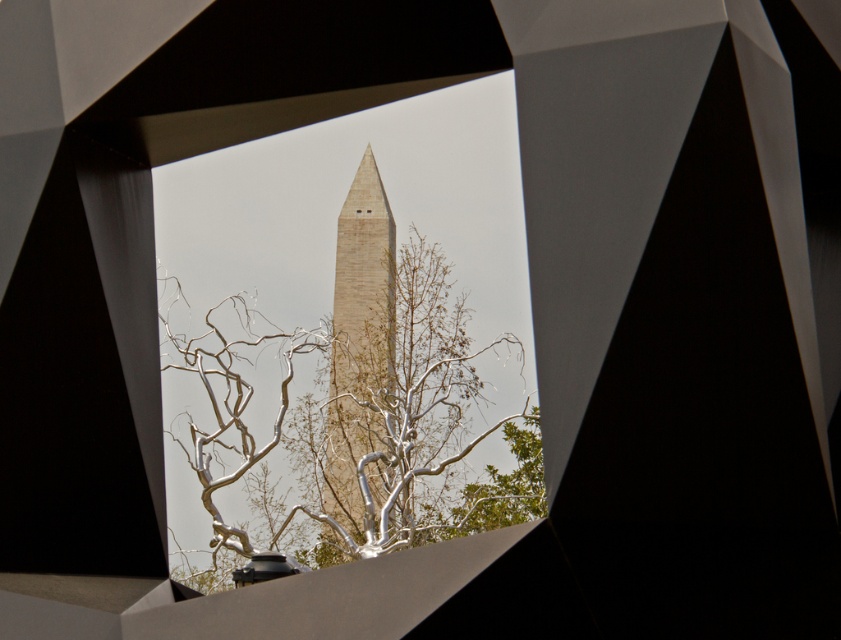
You are standing at the point labeled point at (488,522) in the image. The Washington Monument is 555 feet tall. If you want to place a 100 feet tall statue between you and the Washington Monument, will it block your view of the monument?

The distance between you and the Washington Monument is 156.52 feet. Since the statue is 100 feet tall, which is shorter than the distance, it will not block your view of the monument.

From the picture: You are a tour guide explaining the distance between the silver metallic branches at center and the beige stone obelisk at center to a visitor. What would you say?

The silver metallic branches at center are 7.76 feet away from the beige stone obelisk at center.